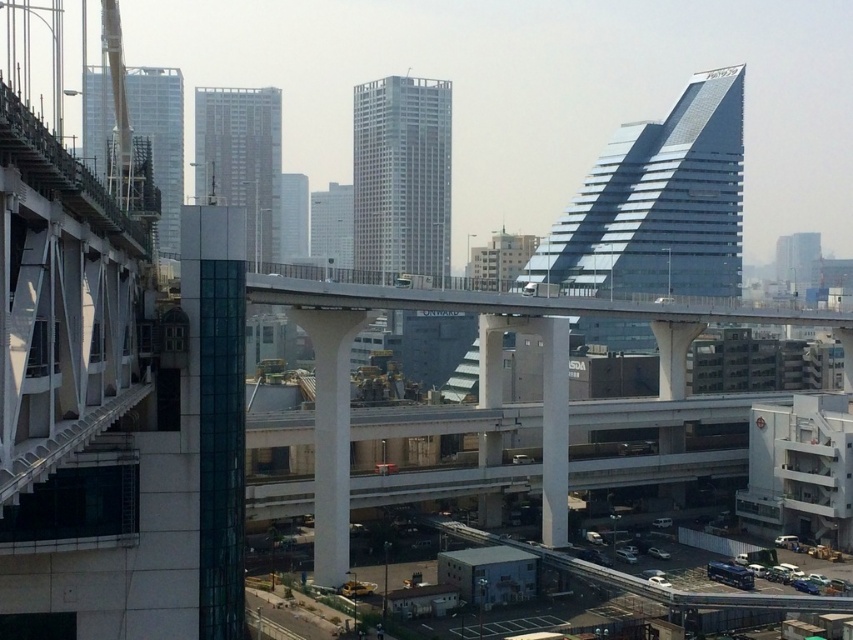
Can you confirm if white glass skyscraper at center is shorter than glassy reflective skyscraper at center?

No.

Is point (326, 262) behind point (302, 208)?

No, it is in front of (302, 208).

Find the location of `white glass skyscraper at center`. white glass skyscraper at center is located at coordinates (331, 227).

Does glassy reflective skyscraper at upper right have a smaller size compared to glassy reflective skyscraper at center?

Incorrect, glassy reflective skyscraper at upper right is not smaller in size than glassy reflective skyscraper at center.

Based on the photo, can you confirm if glassy reflective skyscraper at upper right is bigger than glassy reflective skyscraper at center?

Indeed, glassy reflective skyscraper at upper right has a larger size compared to glassy reflective skyscraper at center.

Where is `glassy reflective skyscraper at upper right`? glassy reflective skyscraper at upper right is located at coordinates (659, 204).

Can you confirm if concrete bridge at center is positioned to the left of gray glass skyscraper at center?

Incorrect, concrete bridge at center is not on the left side of gray glass skyscraper at center.

Where is `concrete bridge at center`? The image size is (853, 640). concrete bridge at center is located at coordinates (479, 372).

From the picture: Measure the distance between concrete bridge at center and camera.

A distance of 80.81 meters exists between concrete bridge at center and camera.

This screenshot has width=853, height=640. In order to click on concrete bridge at center in this screenshot , I will do `click(479, 372)`.